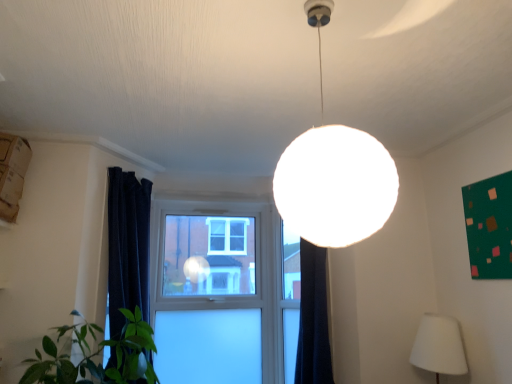
Where is `white fabric lampshade at lower right, which appears as the 2th lamp when viewed from the left`? white fabric lampshade at lower right, which appears as the 2th lamp when viewed from the left is located at coordinates click(439, 346).

The image size is (512, 384). Find the location of `green matte bulletin board at upper right`. green matte bulletin board at upper right is located at coordinates (489, 226).

You are a GUI agent. You are given a task and a screenshot of the screen. Output one action in this format:
    pyautogui.click(x=<x>, y=<y>)
    Task: Click on the clear glass window at center
    The width and height of the screenshot is (512, 384).
    Given the screenshot: What is the action you would take?
    pyautogui.click(x=223, y=293)

Can you confirm if clear glass window at center is wider than white fabric lampshade at lower right, which appears as the 2th lamp when viewed from the left?

In fact, clear glass window at center might be narrower than white fabric lampshade at lower right, which appears as the 2th lamp when viewed from the left.

Is clear glass window at center facing towards white fabric lampshade at lower right, the 1th lamp positioned from the bottom?

No, clear glass window at center is not oriented towards white fabric lampshade at lower right, the 1th lamp positioned from the bottom.

The width and height of the screenshot is (512, 384). I want to click on lamp beneath the clear glass window at center (from a real-world perspective), so click(x=439, y=346).

From the image's perspective, is clear glass window at center over white fabric lampshade at lower right, arranged as the 2th lamp when viewed from the front?

Correct, clear glass window at center appears higher than white fabric lampshade at lower right, arranged as the 2th lamp when viewed from the front, in the image.

In the scene shown: From the image's perspective, is white fabric lampshade at lower right, the 1th lamp viewed from the back, above or below white matte sphere at center, the first lamp positioned from the left?

white fabric lampshade at lower right, the 1th lamp viewed from the back, is below white matte sphere at center, the first lamp positioned from the left.

Consider the image. Is white matte sphere at center, which is the first lamp in top-to-bottom order, at the back of white fabric lampshade at lower right, the 1th lamp viewed from the back?

No, white matte sphere at center, which is the first lamp in top-to-bottom order, is not at the back of white fabric lampshade at lower right, the 1th lamp viewed from the back.

Would you say white fabric lampshade at lower right, the 1th lamp viewed from the back, is a long distance from white matte sphere at center, marked as the 2th lamp in a back-to-front arrangement?

white fabric lampshade at lower right, the 1th lamp viewed from the back, is positioned a significant distance from white matte sphere at center, marked as the 2th lamp in a back-to-front arrangement.

Which of these two, white fabric lampshade at lower right, the 1th lamp positioned from the bottom, or white matte sphere at center, the first lamp positioned from the left, is wider?

With larger width is white matte sphere at center, the first lamp positioned from the left.

Looking at this image, does clear glass window at center have a greater height compared to white matte sphere at center, which is the first lamp in top-to-bottom order?

Indeed, clear glass window at center has a greater height compared to white matte sphere at center, which is the first lamp in top-to-bottom order.

Does clear glass window at center have a lesser width compared to white matte sphere at center, positioned as the first lamp in front-to-back order?

Yes, clear glass window at center is thinner than white matte sphere at center, positioned as the first lamp in front-to-back order.

Does clear glass window at center contain white matte sphere at center, which is the first lamp in top-to-bottom order?

Result: No, white matte sphere at center, which is the first lamp in top-to-bottom order, is not a part of clear glass window at center.

How much distance is there between clear glass window at center and white matte sphere at center, which is the first lamp in top-to-bottom order?

7.77 feet.

Is white fabric lampshade at lower right, which appears as the 2th lamp when viewed from the left, turned away from green matte bulletin board at upper right?

No, white fabric lampshade at lower right, which appears as the 2th lamp when viewed from the left,'s orientation is not away from green matte bulletin board at upper right.

Can you confirm if white fabric lampshade at lower right, the 1th lamp viewed from the back, is taller than green matte bulletin board at upper right?

No.

This screenshot has width=512, height=384. What are the coordinates of `bulletin board on the right of white fabric lampshade at lower right, the 1th lamp when ordered from right to left` in the screenshot? It's located at (489, 226).

Can you confirm if white matte sphere at center, which is the first lamp in top-to-bottom order, is positioned to the left of green matte bulletin board at upper right?

Correct, you'll find white matte sphere at center, which is the first lamp in top-to-bottom order, to the left of green matte bulletin board at upper right.

Is white matte sphere at center, which is the 2th lamp from right to left, facing away from green matte bulletin board at upper right?

white matte sphere at center, which is the 2th lamp from right to left, does not have its back to green matte bulletin board at upper right.

Considering the positions of objects white matte sphere at center, the first lamp positioned from the left, and green matte bulletin board at upper right in the image provided, who is in front, white matte sphere at center, the first lamp positioned from the left, or green matte bulletin board at upper right?

white matte sphere at center, the first lamp positioned from the left, is closer to the camera.

From a real-world perspective, is green matte bulletin board at upper right physically located above or below clear glass window at center?

green matte bulletin board at upper right is situated higher than clear glass window at center in the real world.

Considering the relative sizes of green matte bulletin board at upper right and clear glass window at center in the image provided, is green matte bulletin board at upper right smaller than clear glass window at center?

Yes.

Is green matte bulletin board at upper right next to clear glass window at center and touching it?

No, green matte bulletin board at upper right is not touching clear glass window at center.

Considering the sizes of objects white matte sphere at center, which is the 2th lamp from right to left, and white fabric lampshade at lower right, the 1th lamp positioned from the bottom, in the image provided, who is shorter, white matte sphere at center, which is the 2th lamp from right to left, or white fabric lampshade at lower right, the 1th lamp positioned from the bottom,?

white fabric lampshade at lower right, the 1th lamp positioned from the bottom, is shorter.

Relative to white fabric lampshade at lower right, the 1th lamp positioned from the bottom, is white matte sphere at center, which is the first lamp in top-to-bottom order, in front or behind?

Clearly, white matte sphere at center, which is the first lamp in top-to-bottom order, is in front of white fabric lampshade at lower right, the 1th lamp positioned from the bottom.

Which is more to the right, white matte sphere at center, which is the 2th lamp from right to left, or white fabric lampshade at lower right, which appears as the 2th lamp when viewed from the left?

From the viewer's perspective, white fabric lampshade at lower right, which appears as the 2th lamp when viewed from the left, appears more on the right side.

You are a GUI agent. You are given a task and a screenshot of the screen. Output one action in this format:
    pyautogui.click(x=<x>, y=<y>)
    Task: Click on the window on the left of white fabric lampshade at lower right, arranged as the 2th lamp when viewed from the front
    The image size is (512, 384).
    Given the screenshot: What is the action you would take?
    (x=223, y=293)

Locate an element on the screen. Image resolution: width=512 pixels, height=384 pixels. lamp above the white fabric lampshade at lower right, which appears as the 2th lamp when viewed from the left (from the image's perspective) is located at coordinates (334, 174).

From the image, which object appears to be farther from clear glass window at center, white matte sphere at center, placed as the 2th lamp when sorted from bottom to top, or green matte bulletin board at upper right?

The object further to clear glass window at center is white matte sphere at center, placed as the 2th lamp when sorted from bottom to top.

Estimate the real-world distances between objects in this image. Which object is closer to white fabric lampshade at lower right, the 1th lamp when ordered from right to left, white matte sphere at center, which is the first lamp in top-to-bottom order, or green matte bulletin board at upper right?

green matte bulletin board at upper right is positioned closer to the anchor white fabric lampshade at lower right, the 1th lamp when ordered from right to left.

Based on their spatial positions, is clear glass window at center or white matte sphere at center, which is the first lamp in top-to-bottom order, closer to white fabric lampshade at lower right, placed as the second lamp when sorted from top to bottom?

The object closer to white fabric lampshade at lower right, placed as the second lamp when sorted from top to bottom, is clear glass window at center.

When comparing their distances from white fabric lampshade at lower right, placed as the second lamp when sorted from top to bottom, does green matte bulletin board at upper right or clear glass window at center seem further?

Based on the image, clear glass window at center appears to be further to white fabric lampshade at lower right, placed as the second lamp when sorted from top to bottom.

Considering their positions, is clear glass window at center positioned closer to white matte sphere at center, which is the first lamp in top-to-bottom order, than green matte bulletin board at upper right?

green matte bulletin board at upper right is positioned closer to the anchor white matte sphere at center, which is the first lamp in top-to-bottom order.

Looking at the image, which one is located closer to white fabric lampshade at lower right, which appears as the 2th lamp when viewed from the left, green matte bulletin board at upper right or white matte sphere at center, positioned as the first lamp in front-to-back order?

green matte bulletin board at upper right is closer to white fabric lampshade at lower right, which appears as the 2th lamp when viewed from the left.

From the image, which object appears to be farther from green matte bulletin board at upper right, clear glass window at center or white fabric lampshade at lower right, arranged as the 2th lamp when viewed from the front?

clear glass window at center is positioned further to the anchor green matte bulletin board at upper right.

When comparing their distances from clear glass window at center, does white fabric lampshade at lower right, which appears as the 2th lamp when viewed from the left, or green matte bulletin board at upper right seem closer?

white fabric lampshade at lower right, which appears as the 2th lamp when viewed from the left, is positioned closer to the anchor clear glass window at center.

Locate an element on the screen. This screenshot has width=512, height=384. bulletin board positioned between white matte sphere at center, which is the 2th lamp from right to left, and clear glass window at center from near to far is located at coordinates (489, 226).

Locate an element on the screen. lamp between white matte sphere at center, which is the 2th lamp from right to left, and clear glass window at center in the front-back direction is located at coordinates (439, 346).

Identify the location of bulletin board between white matte sphere at center, which is the 2th lamp from right to left, and white fabric lampshade at lower right, which appears as the 2th lamp when viewed from the left, along the z-axis. (489, 226).